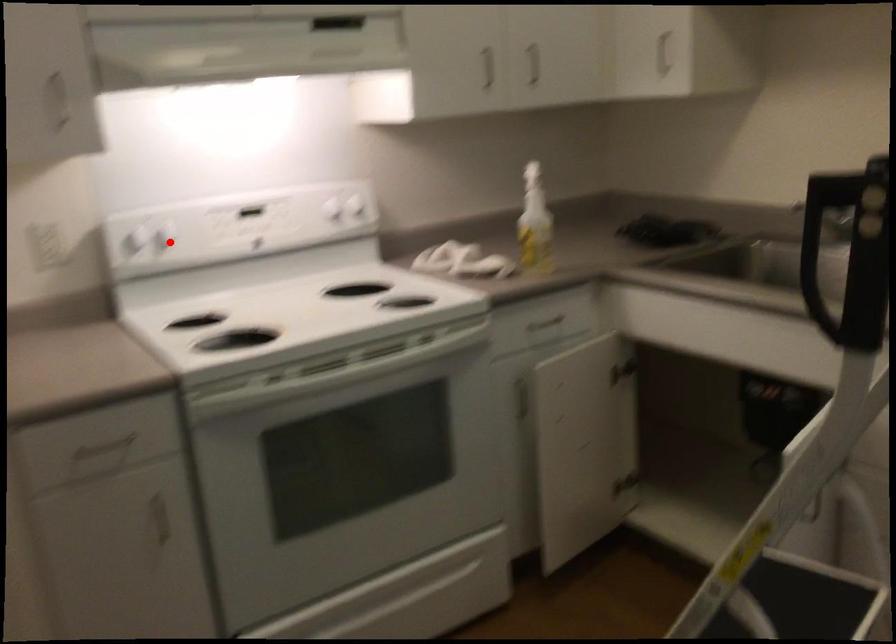
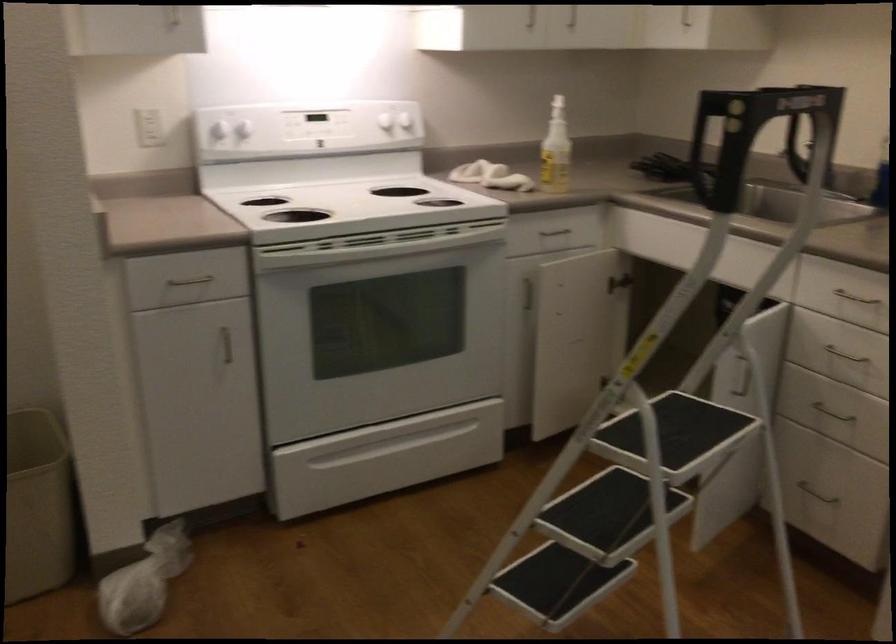
The point at the highlighted location is marked in the first image. Where is the corresponding point in the second image?

(245, 128)